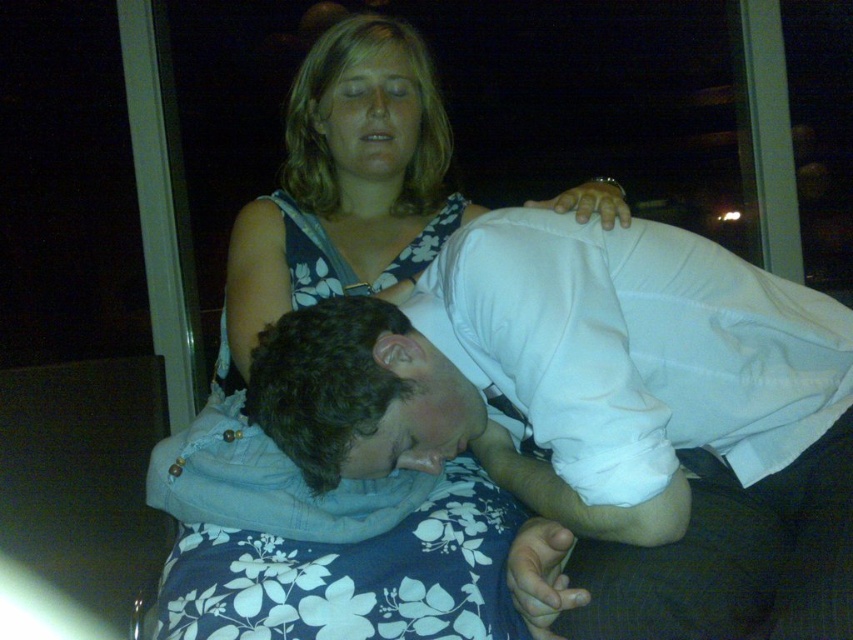
What are the coordinates of `white cotton shirt at center` in the screenshot? It's located at (573, 372).

Is white cotton shirt at center bigger than blue floral dress at center?

Actually, white cotton shirt at center might be smaller than blue floral dress at center.

Between point (532, 301) and point (334, 80), which one is positioned in front?

Point (532, 301) is in front.

At what (x,y) coordinates should I click in order to perform the action: click on white cotton shirt at center. Please return your answer as a coordinate pair (x, y). Image resolution: width=853 pixels, height=640 pixels. Looking at the image, I should click on (573, 372).